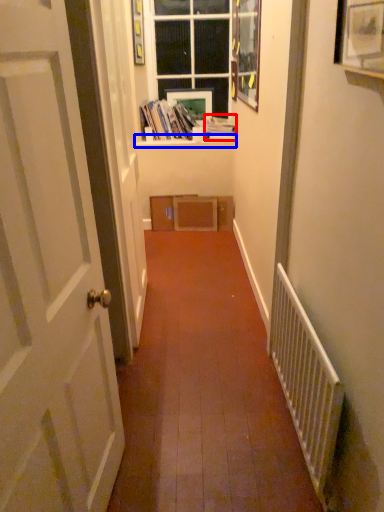
Question: Which object appears closest to the camera in this image, book (highlighted by a red box) or window sill (highlighted by a blue box)?

Choices:
 (A) book
 (B) window sill

Answer: (A)